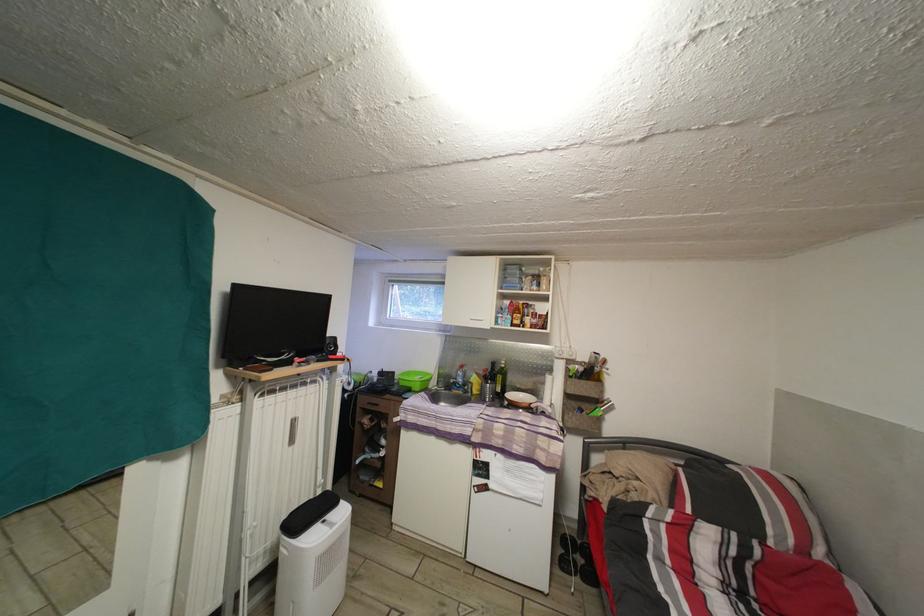
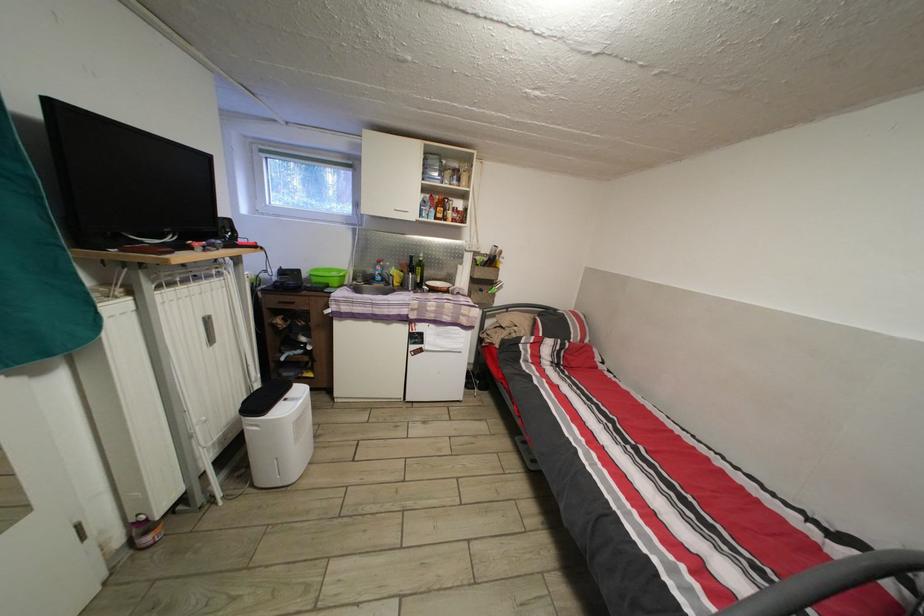
Find the pixel in the second image that matches point 397,288 in the first image.

(269, 156)